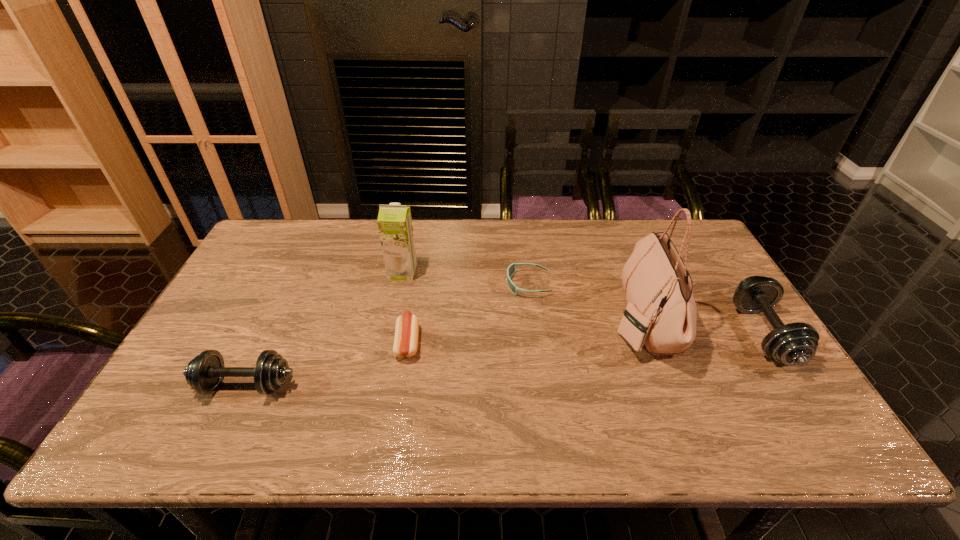
The height and width of the screenshot is (540, 960). I want to click on object at the right edge, so click(x=792, y=344).

You are a GUI agent. You are given a task and a screenshot of the screen. Output one action in this format:
    pyautogui.click(x=<x>, y=<y>)
    Task: Click on the object that is at the near left corner
    The image size is (960, 540).
    Given the screenshot: What is the action you would take?
    pyautogui.click(x=204, y=373)

Where is `object that is at the near right corner`? The width and height of the screenshot is (960, 540). object that is at the near right corner is located at coordinates click(792, 344).

Locate an element on the screen. Image resolution: width=960 pixels, height=540 pixels. vacant space at the far edge of the desktop is located at coordinates (622, 258).

The width and height of the screenshot is (960, 540). Find the location of `vacant region at the near edge of the desktop`. vacant region at the near edge of the desktop is located at coordinates (564, 409).

In the image, there is a desktop. Find the location of `free region at the left edge`. free region at the left edge is located at coordinates (215, 325).

The height and width of the screenshot is (540, 960). In the image, there is a desktop. What are the coordinates of `vacant space at the right edge` in the screenshot? It's located at (741, 316).

You are a GUI agent. You are given a task and a screenshot of the screen. Output one action in this format:
    pyautogui.click(x=<x>, y=<y>)
    Task: Click on the blank region between the tallest object and the right dumbbell
    This screenshot has width=960, height=540.
    Given the screenshot: What is the action you would take?
    pyautogui.click(x=703, y=326)

Find the location of a particular element. unoccupied area between the taller dumbbell and the fourth tallest object is located at coordinates (505, 360).

Where is `unoccupied position between the goggles and the handbag`? unoccupied position between the goggles and the handbag is located at coordinates (586, 301).